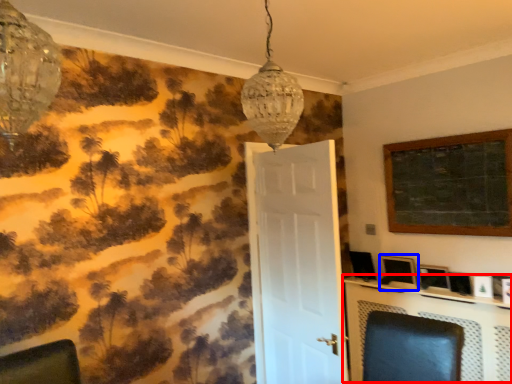
Question: Which object is closer to the camera taking this photo, table (highlighted by a red box) or picture frame (highlighted by a blue box)?

Choices:
 (A) table
 (B) picture frame

Answer: (A)